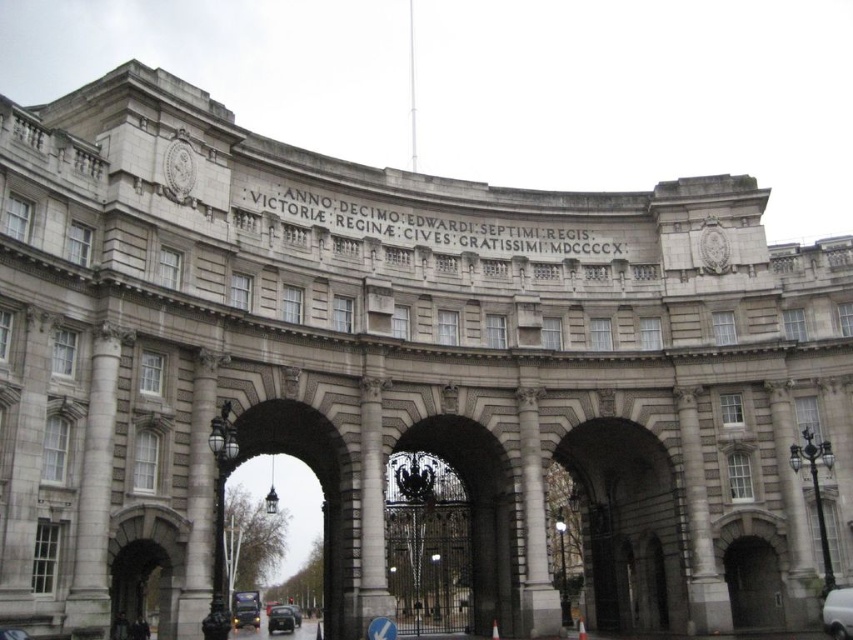
Question: Is gray stone archway at center behind white marble pillar at center?

Choices:
 (A) no
 (B) yes

Answer: (B)

Question: Which of the following is the closest to the observer?

Choices:
 (A) 851,637
 (B) 91,632
 (C) 294,604

Answer: (B)

Question: Based on their relative distances, which object is farther from the shiny black car at center?

Choices:
 (A) gray stone archway at center
 (B) polished stone archway at center
 (C) gray stone column at center

Answer: (C)

Question: Does gray stone column at center lie behind shiny black car at center?

Choices:
 (A) yes
 (B) no

Answer: (B)

Question: Which object is farther from the camera taking this photo?

Choices:
 (A) gray stone pillar at center
 (B) gray stone column at center
 (C) black glossy car at center

Answer: (C)

Question: Considering the relative positions of white marble pillar at center and black glossy car at center in the image provided, where is white marble pillar at center located with respect to black glossy car at center?

Choices:
 (A) below
 (B) above

Answer: (B)